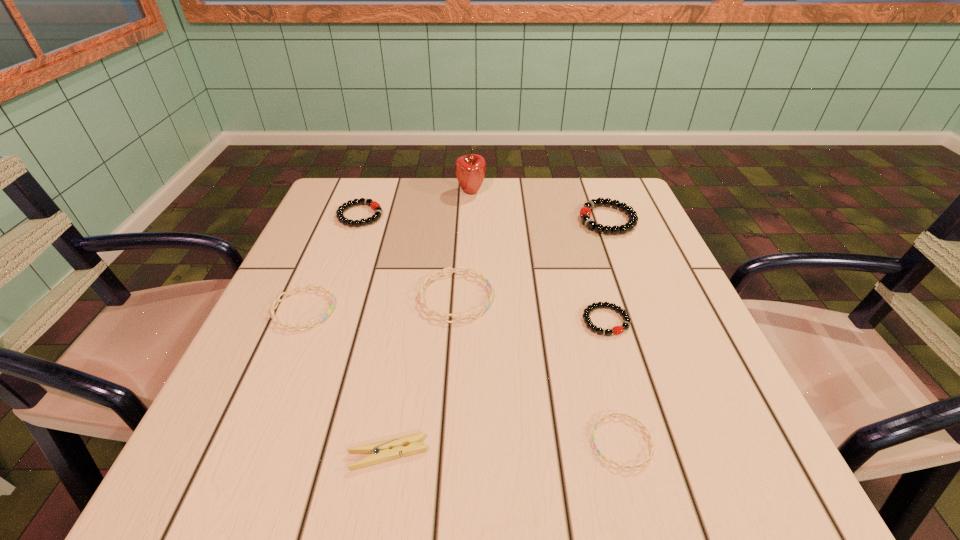
You are a GUI agent. You are given a task and a screenshot of the screen. Output one action in this format:
    pyautogui.click(x=<x>, y=<y>)
    Task: Click on the vacant space positioned 0.370m on the surface of the smallest blue bracelet showing star-shaped elements
    
    Given the screenshot: What is the action you would take?
    pyautogui.click(x=342, y=442)

Locate an element on the screen. apple present at the far edge is located at coordinates (470, 169).

Identify the location of clothespin situated at the near edge. (390, 449).

This screenshot has height=540, width=960. What are the coordinates of `bracelet that is at the near edge` in the screenshot? It's located at (635, 420).

Locate an element on the screen. This screenshot has width=960, height=540. object that is at the far left corner is located at coordinates (374, 205).

Where is `object situated at the far right corner`? This screenshot has height=540, width=960. object situated at the far right corner is located at coordinates (585, 212).

Identify the location of vacant space at the far edge of the desktop. The image size is (960, 540). (482, 193).

In the image, there is a desktop. Identify the location of free space at the near edge. (448, 449).

I want to click on vacant space at the left edge, so click(317, 376).

At what (x,y) coordinates should I click in order to perform the action: click on vacant space at the right edge of the desktop. Please return your answer as a coordinate pair (x, y). Image resolution: width=960 pixels, height=540 pixels. Looking at the image, I should click on (689, 401).